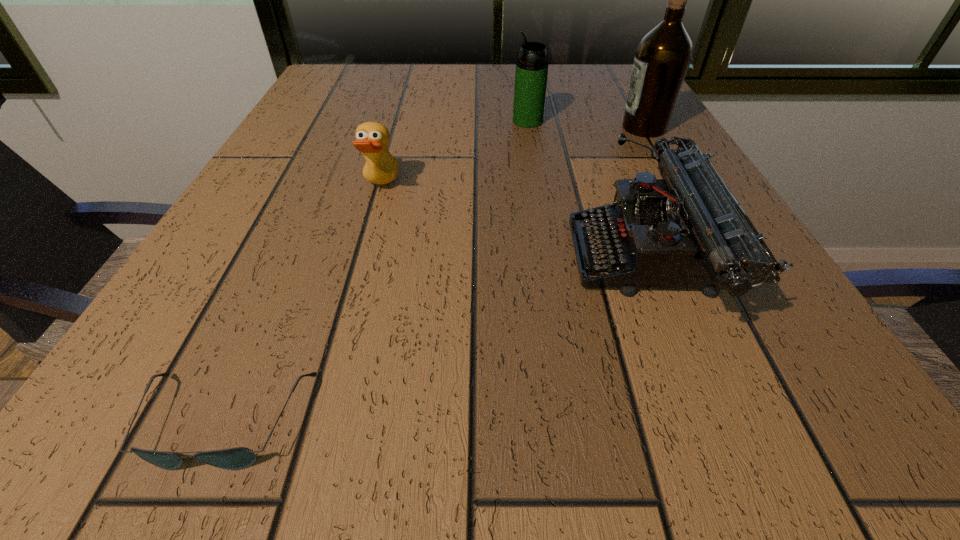
This screenshot has height=540, width=960. Identify the location of vacant space that is in between the typewriter and the fourth shortest object. (588, 190).

At what (x,y) coordinates should I click in order to perform the action: click on free space that is in between the duck and the olive oil. Please return your answer as a coordinate pair (x, y). This screenshot has height=540, width=960. Looking at the image, I should click on (513, 157).

Find the location of `unoccupied position between the duck and the tallest object`. unoccupied position between the duck and the tallest object is located at coordinates (513, 157).

Where is `object identified as the third closest to the sunglasses`? This screenshot has height=540, width=960. object identified as the third closest to the sunglasses is located at coordinates (531, 73).

Identify which object is the third closest to the tallest object. Please provide its 2D coordinates. Your answer should be formatted as a tuple, i.e. [(x, y)], where the tuple contains the x and y coordinates of a point satisfying the conditions above.

[(372, 138)]

Identify the location of vacant space that satisfies the following two spatial constraints: 1. from the spout of the thermos bottle; 2. on the lenses of the nearest object. The image size is (960, 540). (578, 421).

Where is `free spot that satisfies the following two spatial constraints: 1. from the spout of the fourth shortest object; 2. on the lenses of the nearest object`? This screenshot has width=960, height=540. free spot that satisfies the following two spatial constraints: 1. from the spout of the fourth shortest object; 2. on the lenses of the nearest object is located at coordinates (578, 421).